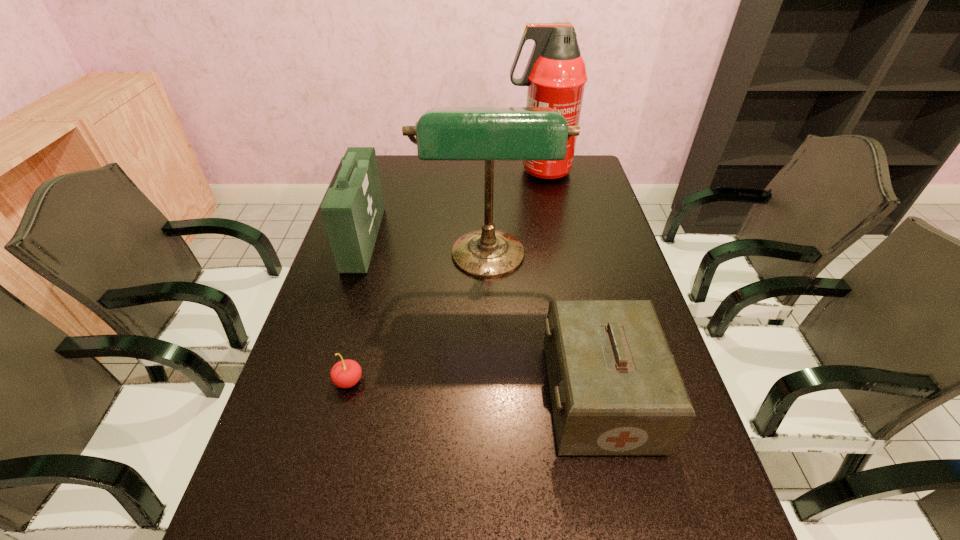
Locate an element on the screen. This screenshot has height=540, width=960. vacant space located 0.050m above the green lampshade of the table lamp is located at coordinates [x=490, y=310].

Identify the location of free space located 0.120m on the front-facing side of the left first-aid kit. The image size is (960, 540). (415, 239).

The width and height of the screenshot is (960, 540). Find the location of `vacant space located on the back of the right first-aid kit`. vacant space located on the back of the right first-aid kit is located at coordinates (573, 279).

The width and height of the screenshot is (960, 540). Find the location of `free space located 0.360m on the back of the shortest object`. free space located 0.360m on the back of the shortest object is located at coordinates (378, 266).

Where is `object that is at the far edge`? The height and width of the screenshot is (540, 960). object that is at the far edge is located at coordinates (555, 74).

I want to click on the first-aid kit situated at the left edge, so pos(352,211).

Image resolution: width=960 pixels, height=540 pixels. Identify the location of cherry that is at the left edge. (346, 373).

The height and width of the screenshot is (540, 960). Find the location of `fire extinguisher located in the right edge section of the desktop`. fire extinguisher located in the right edge section of the desktop is located at coordinates (555, 74).

Identify the location of the first-aid kit present at the right edge. (615, 389).

This screenshot has height=540, width=960. Identify the location of object at the far right corner. (555, 74).